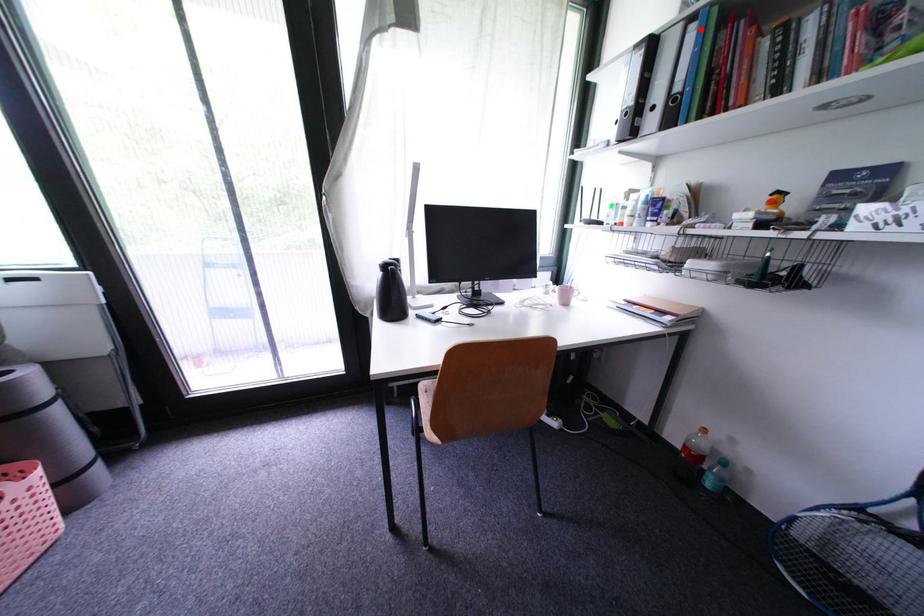
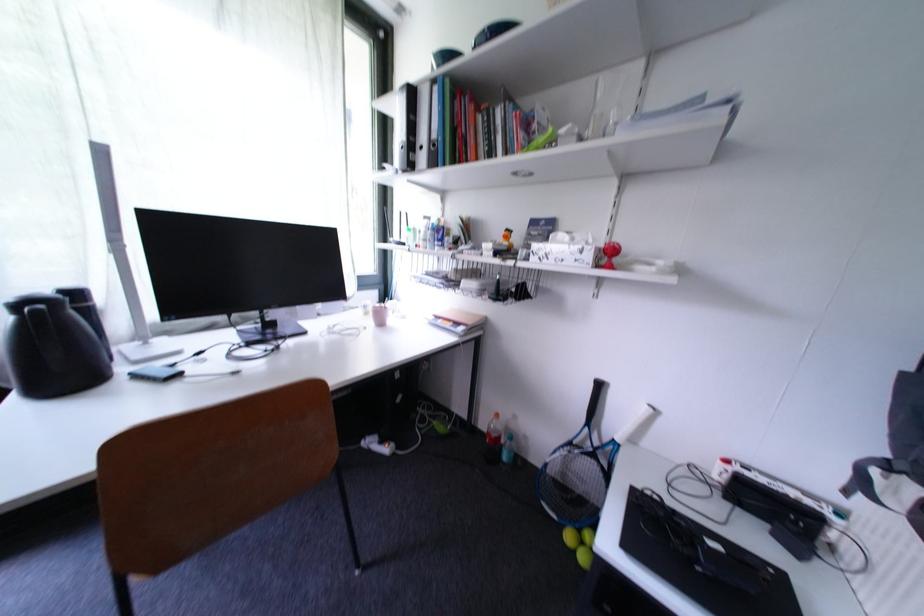
The point at the highlighted location is marked in the first image. Where is the corresponding point in the second image?

(444, 91)